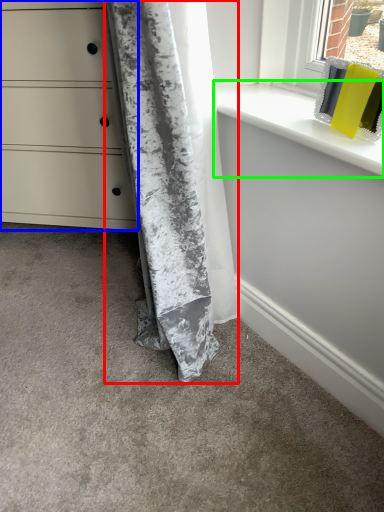
Question: Considering the real-world distances, which object is closest to curtain (highlighted by a red box)? chest of drawers (highlighted by a blue box) or window sill (highlighted by a green box).

Choices:
 (A) chest of drawers
 (B) window sill

Answer: (B)